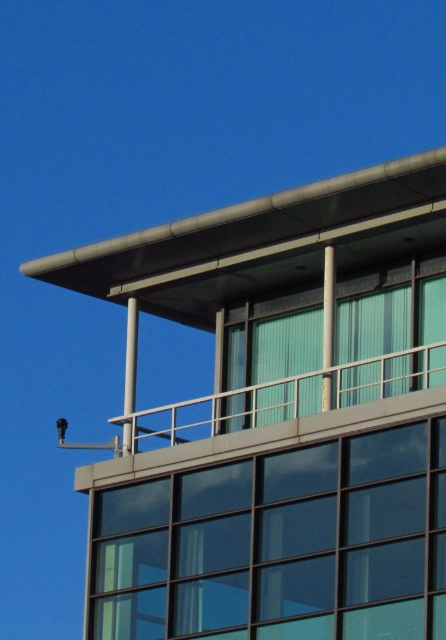
Is transparent glass window at center taller than green glass window at upper center?

Yes.

Does transparent glass window at center come behind green glass window at upper center?

No, it is in front of green glass window at upper center.

Does point (408, 529) come farther from viewer compared to point (400, 369)?

No, it is not.

Identify the location of transparent glass window at center. The height and width of the screenshot is (640, 446). pyautogui.click(x=279, y=545).